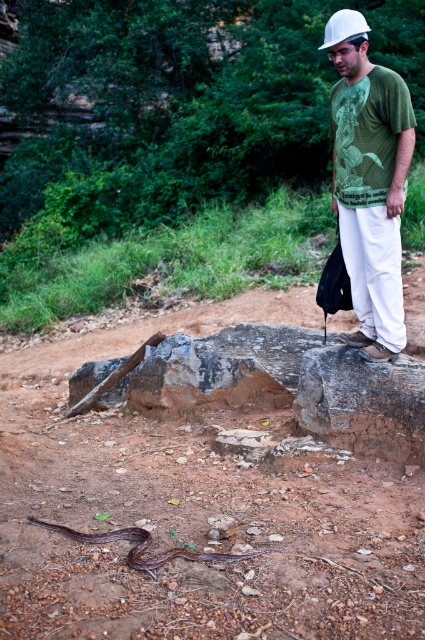
In the scene shown: You are standing at the point labeled point (331, 29) and want to move to the point labeled point (419, 624). Which direction should you move to get closer to your destination?

You should move towards the direction of the camera because point (419, 624) is closer to the camera than point (331, 29).